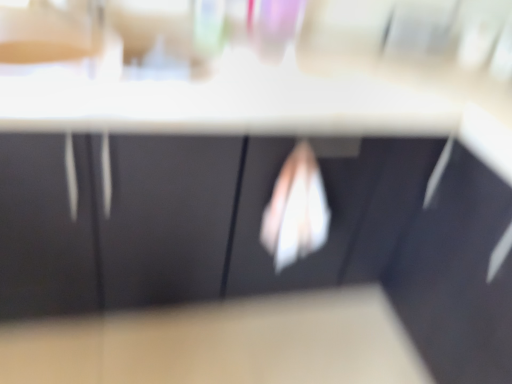
You are a GUI agent. You are given a task and a screenshot of the screen. Output one action in this format:
    pyautogui.click(x=<x>, y=<y>)
    Task: Click on the matte white table at lower center
    This screenshot has height=384, width=512.
    Given the screenshot: What is the action you would take?
    pyautogui.click(x=222, y=344)

Image resolution: width=512 pixels, height=384 pixels. What do you see at coordinates (222, 344) in the screenshot?
I see `matte white table at lower center` at bounding box center [222, 344].

At what (x,y) coordinates should I click in order to perform the action: click on matte white table at lower center. Please return your answer as a coordinate pair (x, y). Looking at the image, I should click on (222, 344).